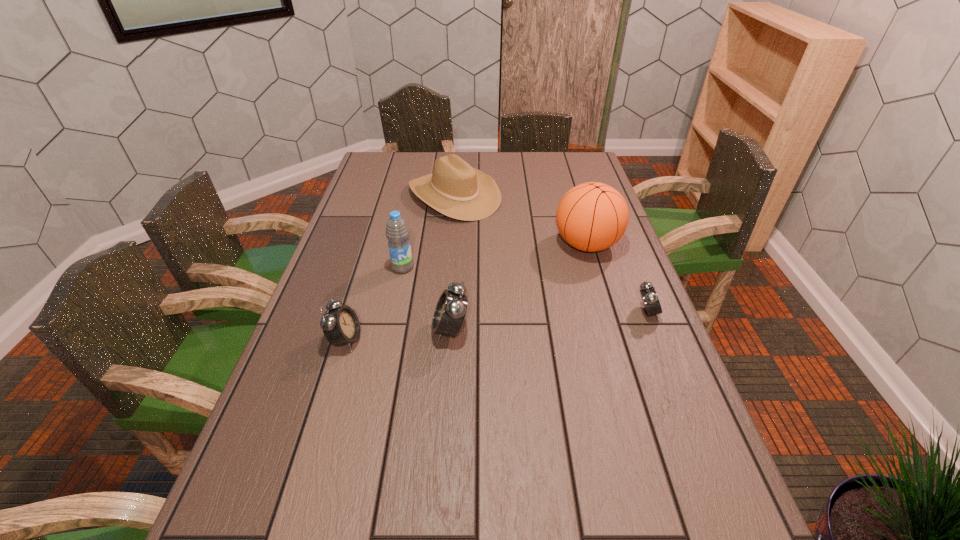
If equal spacing is desired by inserting an extra alarm_clock among them, please point out a free spot for this new alarm_clock. Please provide its 2D coordinates. Your answer should be formatted as a tuple, i.e. [(x, y)], where the tuple contains the x and y coordinates of a point satisfying the conditions above.

[(551, 321)]